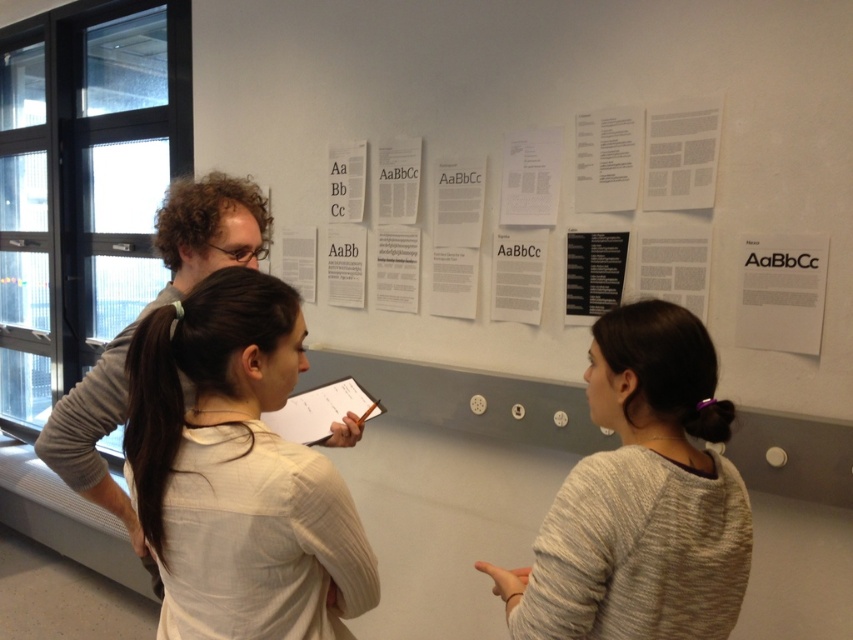
You are a photographer standing in front of the group. You want to take a photo that includes both the gray sweater at center and the white paper at right. Based on their heights, which object should be placed closer to the camera to ensure both are fully visible in the frame?

The gray sweater at center is much taller than the white paper at right, so to ensure both are fully visible, the white paper at right should be placed closer to the camera. This way, the taller gray sweater at center can be captured without being cut off at the top, while the shorter white paper at right will still be in frame.

You are standing in front of the collaborative discussion wall with three people. There is a point marked at coordinates point [648,428]. If you want to reach this point without moving your feet, can you do it with your outstretched hand?

The point [648,428] is 3.61 feet from the viewer. Since an average person can reach about 3 feet with their outstretched hand, you would need to move closer to reach it.

You are a photographer trying to capture a closeup of the white paper at right without including the gray sweater at center in the frame. Based on their sizes, is this possible?

The gray sweater at center is bigger than white paper at right, so it might be challenging to frame the white paper at right without including the gray sweater at center due to its larger size.